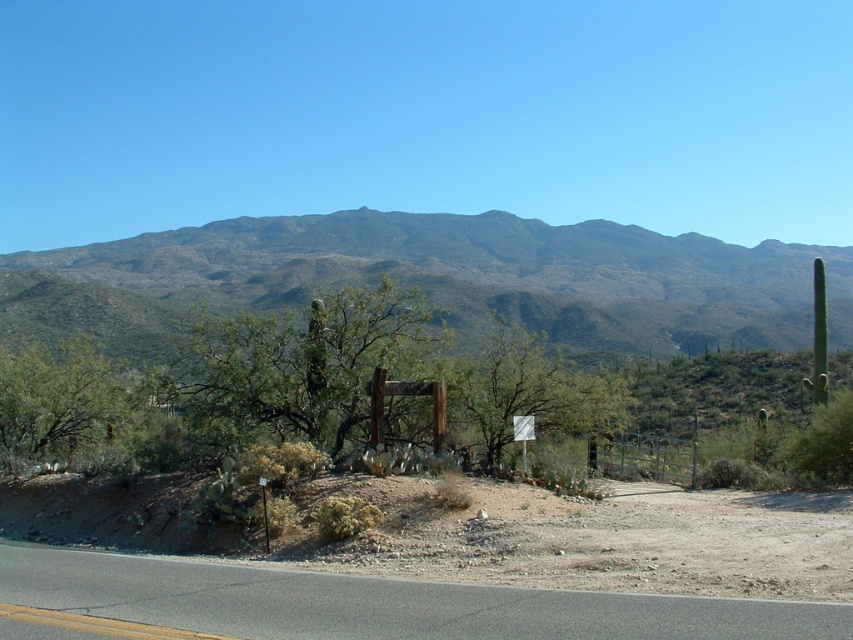
Question: Does green textured mountain range at upper center appear over asphalt road at lower center?

Choices:
 (A) yes
 (B) no

Answer: (A)

Question: Is green textured mountain range at upper center above asphalt road at lower center?

Choices:
 (A) no
 (B) yes

Answer: (B)

Question: Which point is farther from the camera taking this photo?

Choices:
 (A) (843, 333)
 (B) (515, 420)
 (C) (851, 612)

Answer: (A)

Question: Which point is closer to the camera taking this photo?

Choices:
 (A) (236, 294)
 (B) (526, 426)

Answer: (B)

Question: Based on their relative distances, which object is farther from the asphalt road at lower center?

Choices:
 (A) white plastic sign at center
 (B) green textured mountain range at upper center

Answer: (B)

Question: Is green textured mountain range at upper center positioned before white plastic sign at center?

Choices:
 (A) no
 (B) yes

Answer: (A)